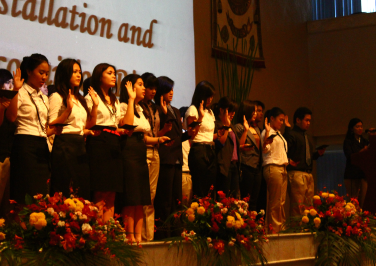
Where is `window`? The height and width of the screenshot is (266, 376). window is located at coordinates (341, 10).